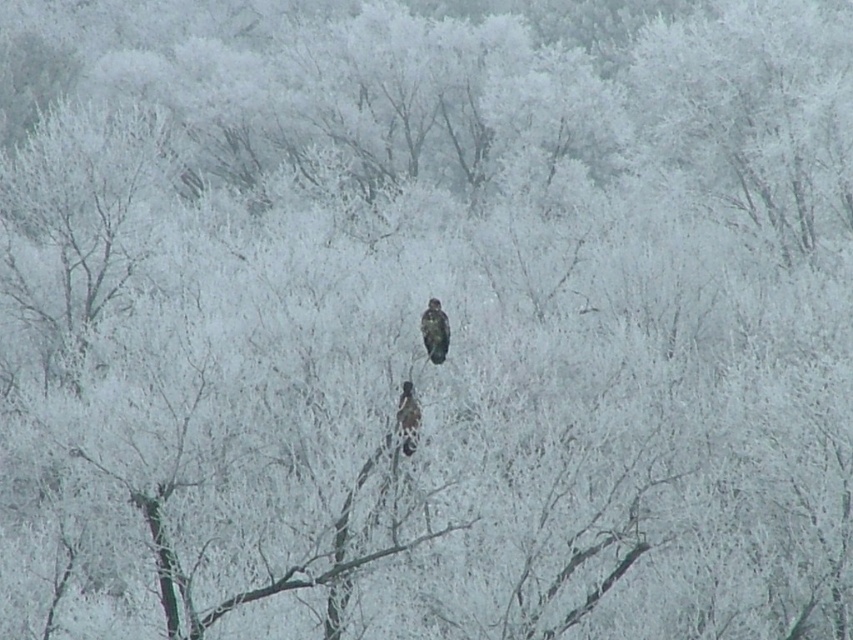
Question: Can you confirm if brown feathered bird at center is wider than dark brown feathers at center?

Choices:
 (A) yes
 (B) no

Answer: (A)

Question: Which point is farther to the camera?

Choices:
 (A) brown feathered bird at center
 (B) dark brown feathers at center

Answer: (A)

Question: Is brown feathered bird at center in front of dark brown feathers at center?

Choices:
 (A) yes
 (B) no

Answer: (B)

Question: Can you confirm if brown feathered bird at center is positioned below dark brown feathers at center?

Choices:
 (A) yes
 (B) no

Answer: (B)

Question: Which point appears farthest from the camera in this image?

Choices:
 (A) (410, 403)
 (B) (445, 326)

Answer: (B)